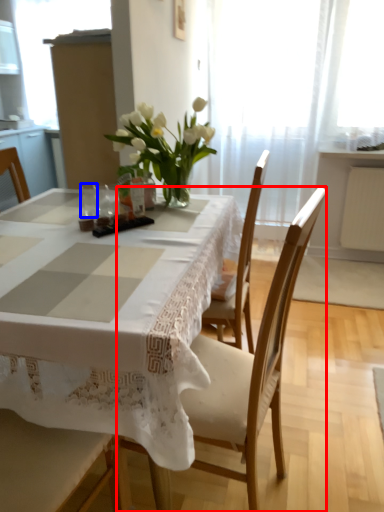
Question: Which point is further to the camera, chair (highlighted by a red box) or tableware (highlighted by a blue box)?

Choices:
 (A) chair
 (B) tableware

Answer: (B)